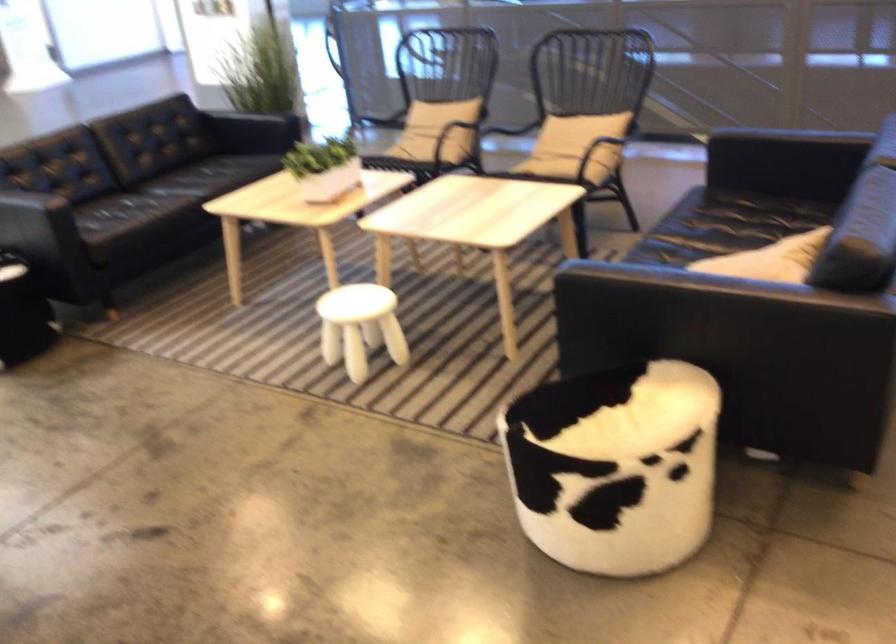
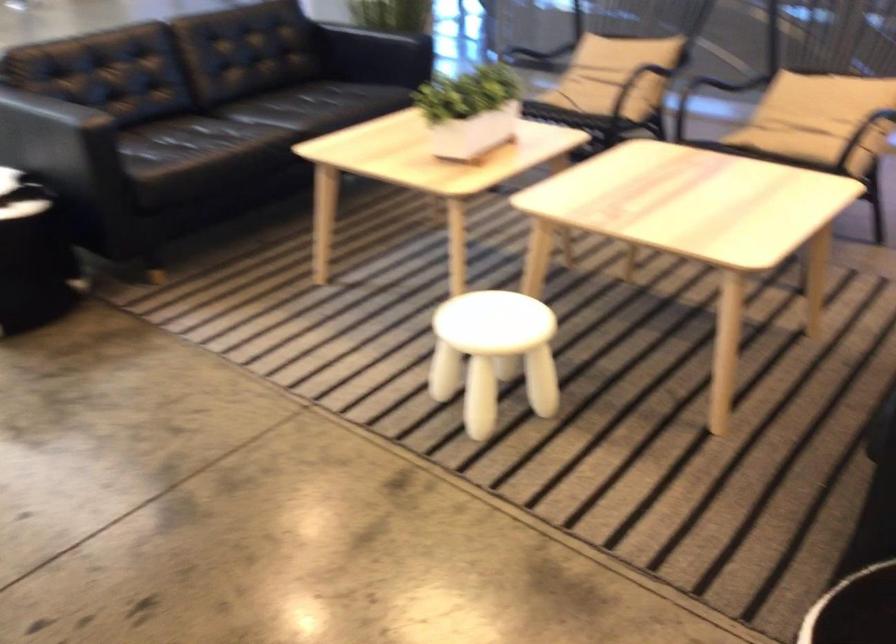
Locate, in the second image, the point that corresponds to (563,146) in the first image.

(817, 118)